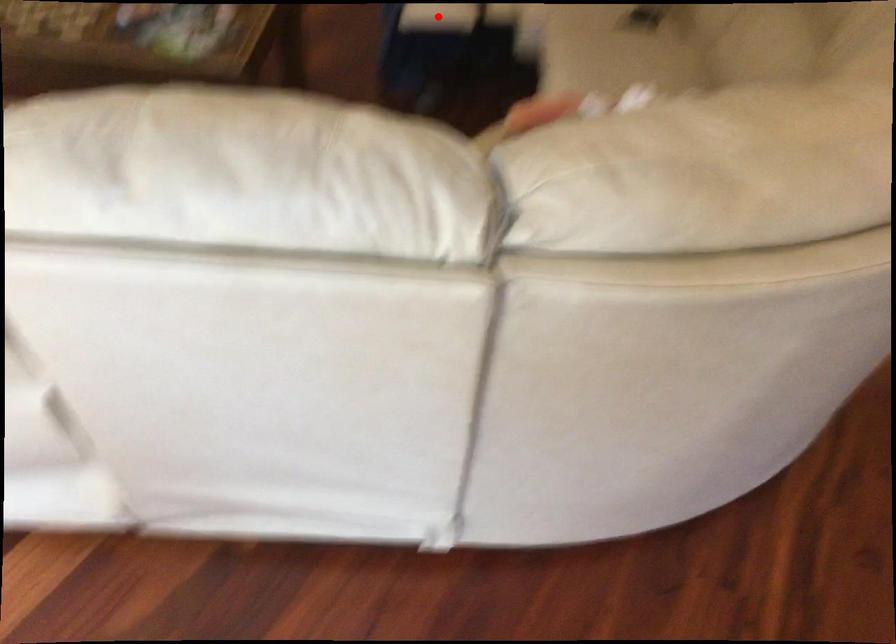
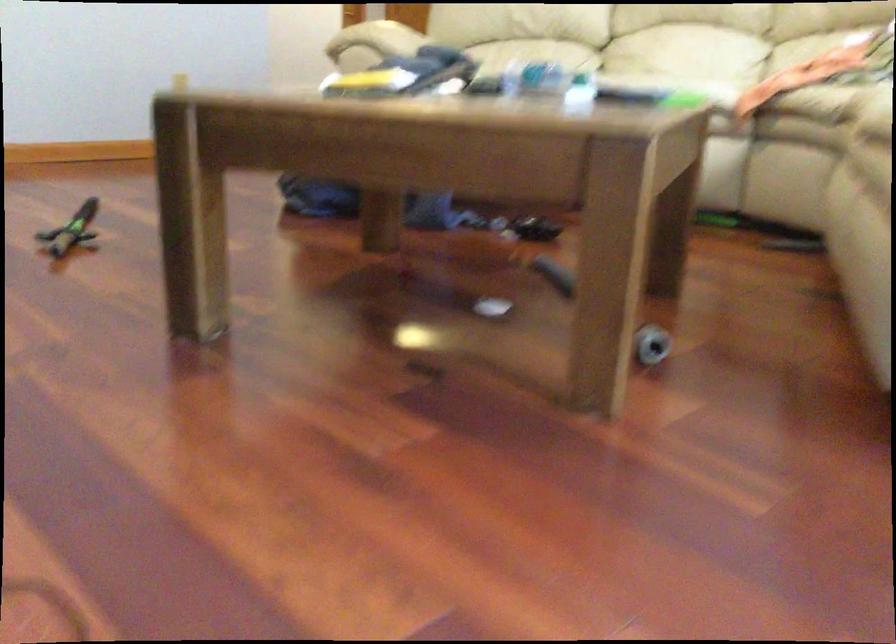
Question: I am providing you with two images of the same scene from different viewpoints. A red point is marked on the first image. Is the red point's position out of view in image 2?

Choices:
 (A) Yes
 (B) No

Answer: (A)